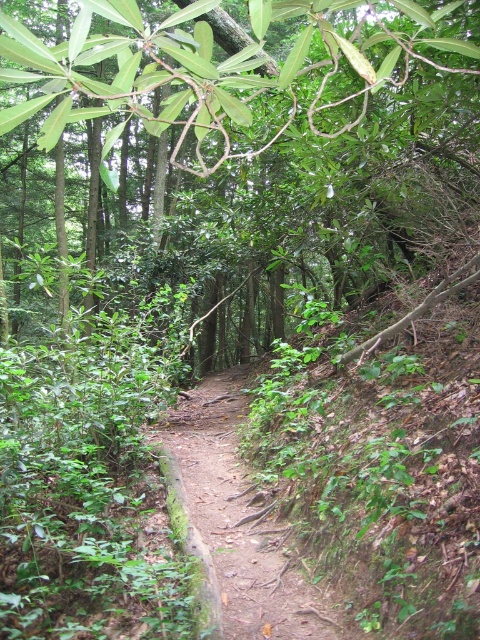
You are a hiker trying to navigate the forest path. You see a green leafy tree at center. Can you walk directly towards the green leafy tree at center from your current position at point (274, 129)?

The green leafy tree at center is located at point (274, 129), so you are already at that location. You cannot walk towards it from the same spot.

You are standing at the center of the dirt path in the forest. You want to locate the green leafy tree at center. Which direction should you look to see it?

The green leafy tree at center is located at point coordinates of 0.202 on the x axis and 0.571 on the y axis. Since you are at the center of the dirt path, you should look towards the coordinates to find the tree.